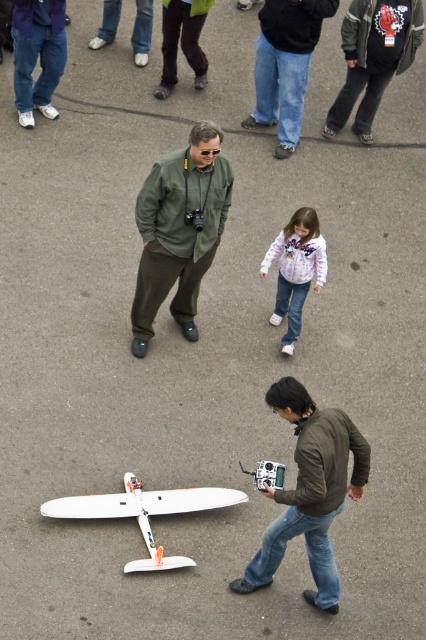
How distant is white fleece jacket at center from brown leather pants at upper center?

white fleece jacket at center and brown leather pants at upper center are 3.57 meters apart from each other.

Is white fleece jacket at center above brown leather pants at upper center?

No.

The height and width of the screenshot is (640, 426). What do you see at coordinates (296, 269) in the screenshot?
I see `white fleece jacket at center` at bounding box center [296, 269].

You are a GUI agent. You are given a task and a screenshot of the screen. Output one action in this format:
    pyautogui.click(x=<x>, y=<y>)
    Task: Click on the white fleece jacket at center
    The height and width of the screenshot is (640, 426).
    Given the screenshot: What is the action you would take?
    pyautogui.click(x=296, y=269)

Who is higher up, green matte jacket at center or white matte airplane at lower center?

green matte jacket at center

Can you confirm if green matte jacket at center is positioned to the left of white matte airplane at lower center?

In fact, green matte jacket at center is to the right of white matte airplane at lower center.

Is point (196, 253) more distant than point (210, 496)?

Yes.

At what (x,y) coordinates should I click in order to perform the action: click on green matte jacket at center. Please return your answer as a coordinate pair (x, y). The image size is (426, 640). Looking at the image, I should click on (178, 230).

Locate an element on the screen. This screenshot has width=426, height=640. brown leather jacket at lower right is located at coordinates (310, 492).

Does brown leather jacket at lower right have a larger size compared to white matte airplane at lower center?

Yes.

Which is behind, point (356, 458) or point (129, 564)?

The point (129, 564) is behind.

Identify the location of brown leather jacket at lower right. The image size is (426, 640). (310, 492).